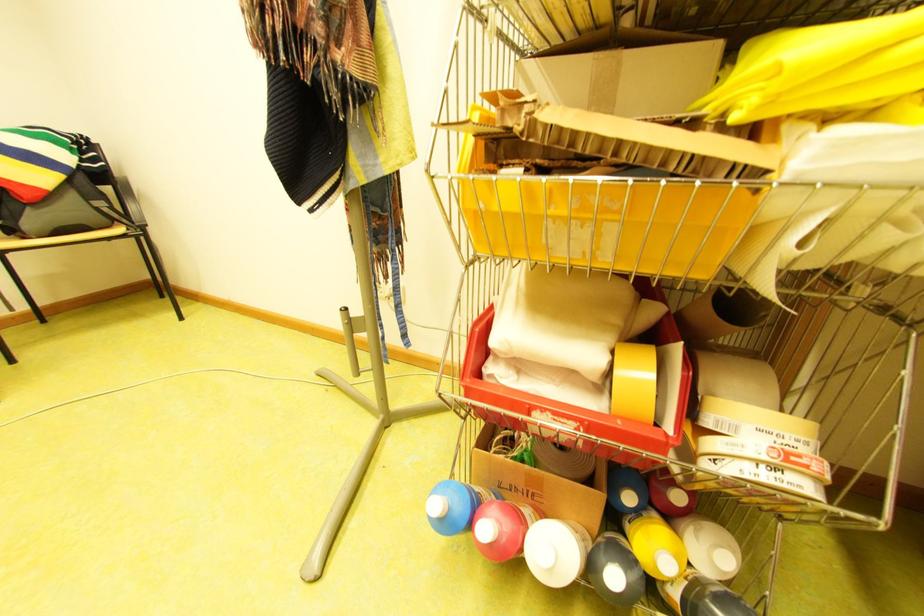
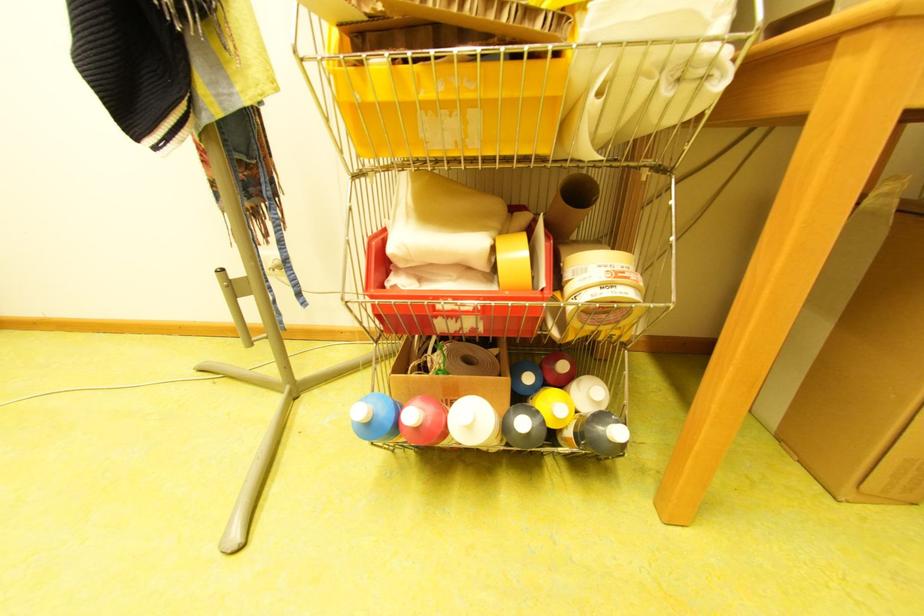
The images are taken continuously from a first-person perspective. In which direction are you moving?

The movement direction of the cameraman is left, backward.